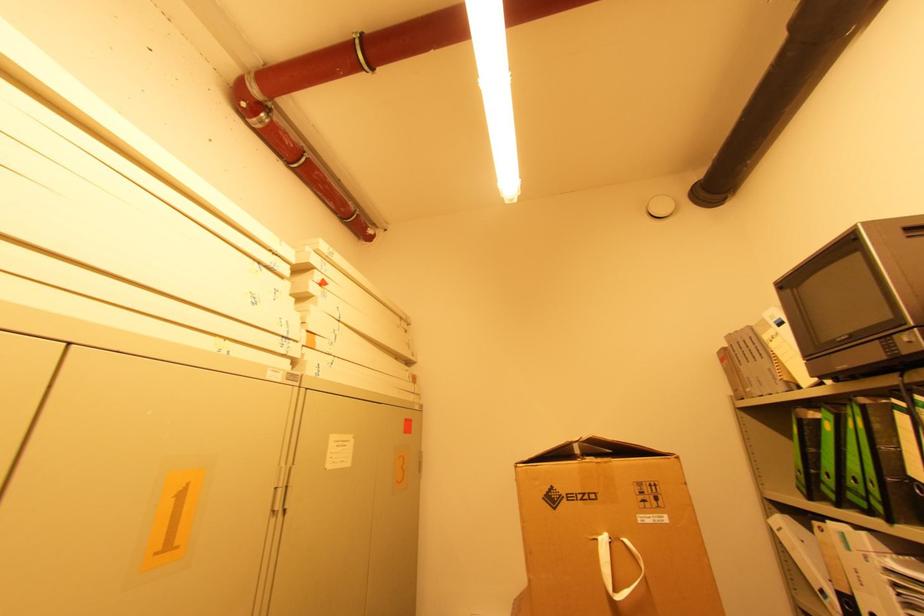
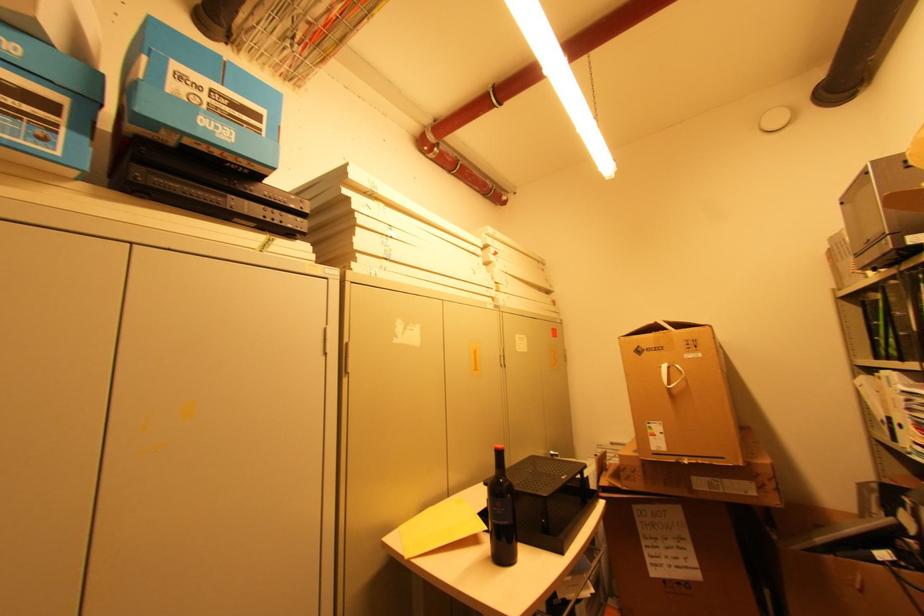
Find the pixel in the second image that matches point (882, 440) in the first image.

(896, 310)